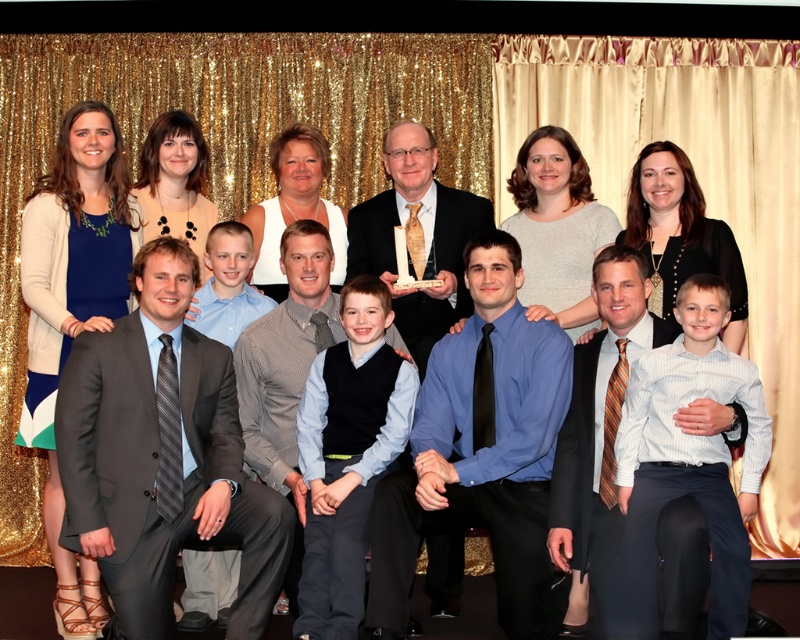
Does gray textured suit at center appear on the left side of matte black suit at center?

Yes, gray textured suit at center is to the left of matte black suit at center.

Between point (290, 365) and point (417, 339), which one is positioned behind?

Point (417, 339)

Who is more forward, (280, 412) or (432, 221)?

Point (280, 412) is in front.

The height and width of the screenshot is (640, 800). Find the location of `gray textured suit at center`. gray textured suit at center is located at coordinates (286, 365).

Between blue satin shirt at center and striped tie at center, which one has less height?

striped tie at center

Locate an element on the screen. The image size is (800, 640). blue satin shirt at center is located at coordinates (480, 451).

Does blue satin shirt at center have a lesser height compared to gray textured suit at center?

Yes, blue satin shirt at center is shorter than gray textured suit at center.

This screenshot has width=800, height=640. Describe the element at coordinates (480, 451) in the screenshot. I see `blue satin shirt at center` at that location.

Image resolution: width=800 pixels, height=640 pixels. Identify the location of blue satin shirt at center. (480, 451).